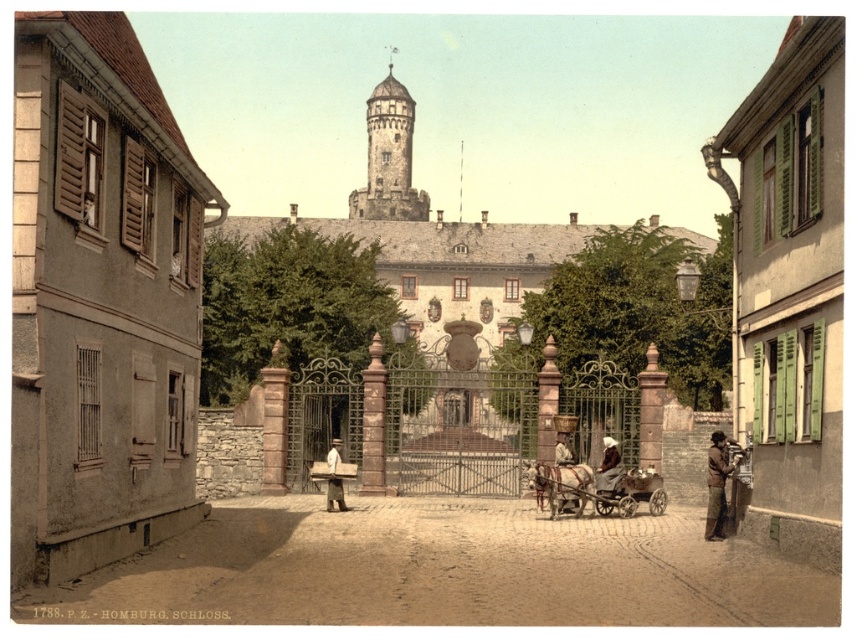
You are an architect visiting this historical site. You notice the brown stone tower at center and the brown leather jacket at lower right. Which object is taller?

The brown stone tower at center is taller than the brown leather jacket at lower right.

You are a tailor observing the historical scene. You need to determine which garment, the brown leather jacket at lower right or the brown leather coat at center, requires more fabric to make based on their sizes. Which one would you choose?

The brown leather jacket at lower right requires more fabric because its width is larger than the brown leather coat at center.